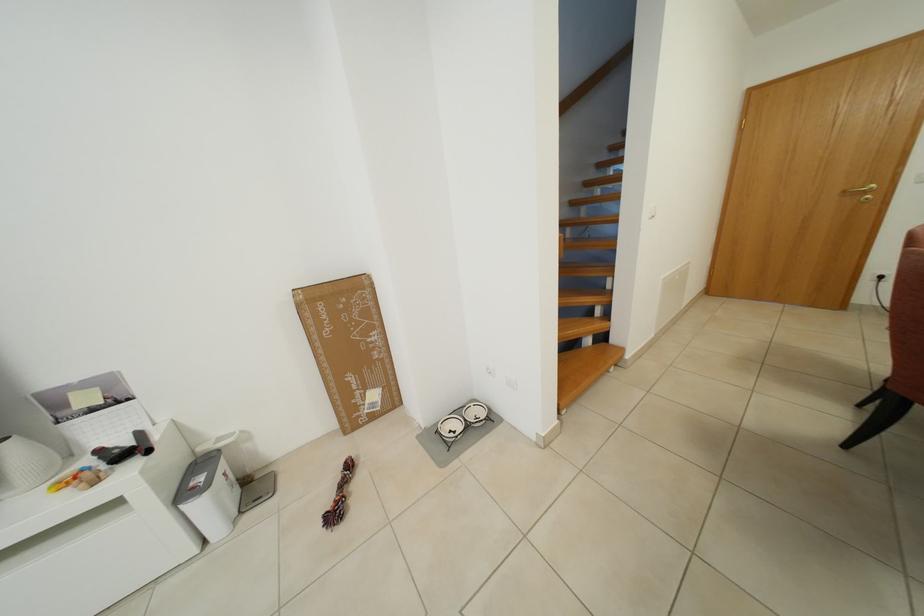
Where is `white textured vase`? The height and width of the screenshot is (616, 924). white textured vase is located at coordinates (25, 464).